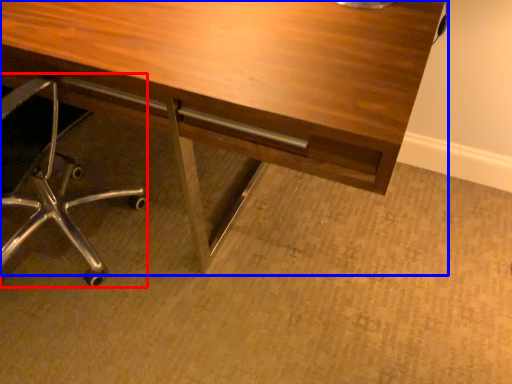
Question: Among these objects, which one is nearest to the camera, chair (highlighted by a red box) or desk (highlighted by a blue box)?

Choices:
 (A) chair
 (B) desk

Answer: (A)